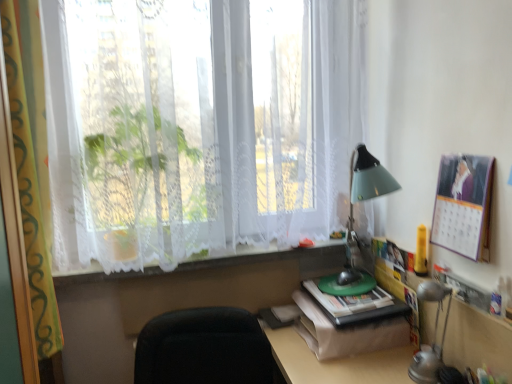
Find the location of a particular element. The width and height of the screenshot is (512, 384). green plastic desk at lower right is located at coordinates (338, 354).

Describe the element at coordinates (463, 205) in the screenshot. I see `matte paper calendar at upper right` at that location.

What do you see at coordinates (193, 129) in the screenshot? Image resolution: width=512 pixels, height=384 pixels. I see `white lace curtains at upper center` at bounding box center [193, 129].

The image size is (512, 384). Find the location of `black fabric chair at lower center`. black fabric chair at lower center is located at coordinates (205, 349).

Locate an element on the screen. The height and width of the screenshot is (384, 512). yellow matte candle at right is located at coordinates (421, 252).

I want to click on metallic silver table lamp at lower right, so click(433, 338).

From the picture: Between black fabric chair at lower center and metallic silver table lamp at lower right, which one has smaller width?

metallic silver table lamp at lower right is thinner.

Find the location of a particular element. The image size is (512, 384). chair on the left of the metallic silver table lamp at lower right is located at coordinates [205, 349].

From a real-world perspective, is black fabric chair at lower center above or below metallic silver table lamp at lower right?

In terms of real-world spatial position, black fabric chair at lower center is below metallic silver table lamp at lower right.

Between black fabric chair at lower center and metallic silver table lamp at lower right, which one appears on the right side from the viewer's perspective?

From the viewer's perspective, metallic silver table lamp at lower right appears more on the right side.

Does white lace curtains at upper center have a greater width compared to black fabric chair at lower center?

No, white lace curtains at upper center is not wider than black fabric chair at lower center.

Is white lace curtains at upper center far away from black fabric chair at lower center?

white lace curtains at upper center is near black fabric chair at lower center, not far away.

This screenshot has height=384, width=512. Identify the location of chair directly beneath the white lace curtains at upper center (from a real-world perspective). (205, 349).

From a real-world perspective, does white lace curtains at upper center stand above black fabric chair at lower center?

Indeed, from a real-world perspective, white lace curtains at upper center stands above black fabric chair at lower center.

Between matte paper calendar at upper right and metallic silver table lamp at lower right, which one appears on the right side from the viewer's perspective?

From the viewer's perspective, matte paper calendar at upper right appears more on the right side.

This screenshot has height=384, width=512. What are the coordinates of `table lamp directly beneath the matte paper calendar at upper right (from a real-world perspective)` in the screenshot? It's located at (433, 338).

From a real-world perspective, between matte paper calendar at upper right and metallic silver table lamp at lower right, who is vertically higher?

matte paper calendar at upper right.

Looking at this image, how much distance is there between matte paper calendar at upper right and white lace curtain at left?

They are 3.94 feet apart.

Is matte paper calendar at upper right positioned behind white lace curtain at left?

Yes, it is.

Who is smaller, matte paper calendar at upper right or white lace curtain at left?

Smaller between the two is matte paper calendar at upper right.

Is matte paper calendar at upper right at the left side of white lace curtain at left?

In fact, matte paper calendar at upper right is to the right of white lace curtain at left.

Is point (434, 293) positioned behind point (349, 377)?

Yes, it is.

From a real-world perspective, is metallic silver table lamp at lower right over green plastic desk at lower right?

Indeed, from a real-world perspective, metallic silver table lamp at lower right stands above green plastic desk at lower right.

Considering the relative positions of metallic silver table lamp at lower right and green plastic desk at lower right in the image provided, is metallic silver table lamp at lower right to the left of green plastic desk at lower right from the viewer's perspective?

No, metallic silver table lamp at lower right is not to the left of green plastic desk at lower right.

What's the angular difference between metallic silver table lamp at lower right and green plastic desk at lower right's facing directions?

metallic silver table lamp at lower right and green plastic desk at lower right are facing 6.7 degrees away from each other.

At what (x,y) coordinates should I click in order to perform the action: click on bulletin board above the metallic silver table lamp at lower right (from a real-world perspective). Please return your answer as a coordinate pair (x, y). Looking at the image, I should click on (463, 205).

From a real-world perspective, relative to matte paper calendar at upper right, is metallic silver table lamp at lower right vertically above or below?

In terms of real-world spatial position, metallic silver table lamp at lower right is below matte paper calendar at upper right.

Considering the positions of objects metallic silver table lamp at lower right and matte paper calendar at upper right in the image provided, who is more to the right, metallic silver table lamp at lower right or matte paper calendar at upper right?

matte paper calendar at upper right.

Is metallic silver table lamp at lower right facing towards matte paper calendar at upper right?

No, metallic silver table lamp at lower right is not oriented towards matte paper calendar at upper right.

In terms of size, does matte paper calendar at upper right appear bigger or smaller than black fabric chair at lower center?

Considering their sizes, matte paper calendar at upper right takes up less space than black fabric chair at lower center.

Image resolution: width=512 pixels, height=384 pixels. I want to click on chair below the matte paper calendar at upper right (from a real-world perspective), so click(205, 349).

Can you tell me how much matte paper calendar at upper right and black fabric chair at lower center differ in facing direction?

85.7 degrees separate the facing orientations of matte paper calendar at upper right and black fabric chair at lower center.

From a real-world perspective, is matte paper calendar at upper right physically below black fabric chair at lower center?

No.

Locate an element on the screen. The width and height of the screenshot is (512, 384). chair that appears on the left of metallic silver table lamp at lower right is located at coordinates (205, 349).

The image size is (512, 384). I want to click on chair that appears below the white lace curtains at upper center (from a real-world perspective), so click(205, 349).

Estimate the real-world distances between objects in this image. Which object is further from black fabric chair at lower center, white lace at center or white lace curtain at left?

white lace curtain at left is further to black fabric chair at lower center.

Based on their spatial positions, is matte paper calendar at upper right or white lace curtains at upper center further from black fabric chair at lower center?

matte paper calendar at upper right is further to black fabric chair at lower center.

Which object lies further to the anchor point metallic silver table lamp at lower right, matte paper calendar at upper right or white lace curtains at upper center?

white lace curtains at upper center is positioned further to the anchor metallic silver table lamp at lower right.

Estimate the real-world distances between objects in this image. Which object is closer to white lace curtains at upper center, green matte book at bottom right or green plastic desk at lower right?

green plastic desk at lower right.

Looking at the image, which one is located closer to green plastic desk at lower right, metallic silver table lamp at lower right or green matte book at bottom right?

Among the two, green matte book at bottom right is located nearer to green plastic desk at lower right.

Considering their positions, is white lace curtains at upper center positioned further to yellow matte candle at right than green matte book at bottom right?

white lace curtains at upper center is positioned further to the anchor yellow matte candle at right.

Which object lies further to the anchor point green matte book at bottom right, white lace at center or black fabric chair at lower center?

black fabric chair at lower center is positioned further to the anchor green matte book at bottom right.

Estimate the real-world distances between objects in this image. Which object is closer to matte paper calendar at upper right, white lace curtain at left or yellow matte candle at right?

Among the two, yellow matte candle at right is located nearer to matte paper calendar at upper right.

Where is `window situated between white lace curtain at left and metallic silver table lamp at lower right from left to right`? window situated between white lace curtain at left and metallic silver table lamp at lower right from left to right is located at coordinates (193, 129).

The width and height of the screenshot is (512, 384). Identify the location of chair between white lace at center and yellow matte candle at right. (205, 349).

Where is `bulletin board positioned between green plastic desk at lower right and yellow matte candle at right from near to far`? This screenshot has height=384, width=512. bulletin board positioned between green plastic desk at lower right and yellow matte candle at right from near to far is located at coordinates (463, 205).

Locate an element on the screen. The height and width of the screenshot is (384, 512). computer desk between white lace curtains at upper center and black fabric chair at lower center from top to bottom is located at coordinates (338, 354).